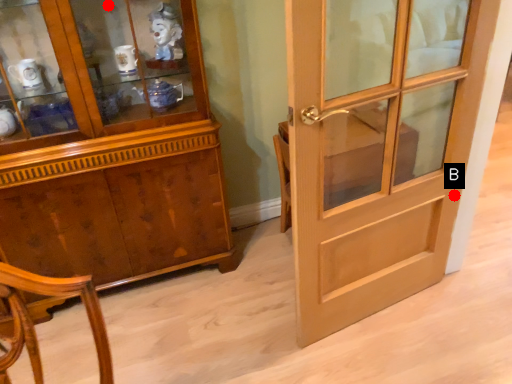
Question: Two points are circled on the image, labeled by A and B beside each circle. Which point is closer to the camera?

Choices:
 (A) A is closer
 (B) B is closer

Answer: (A)